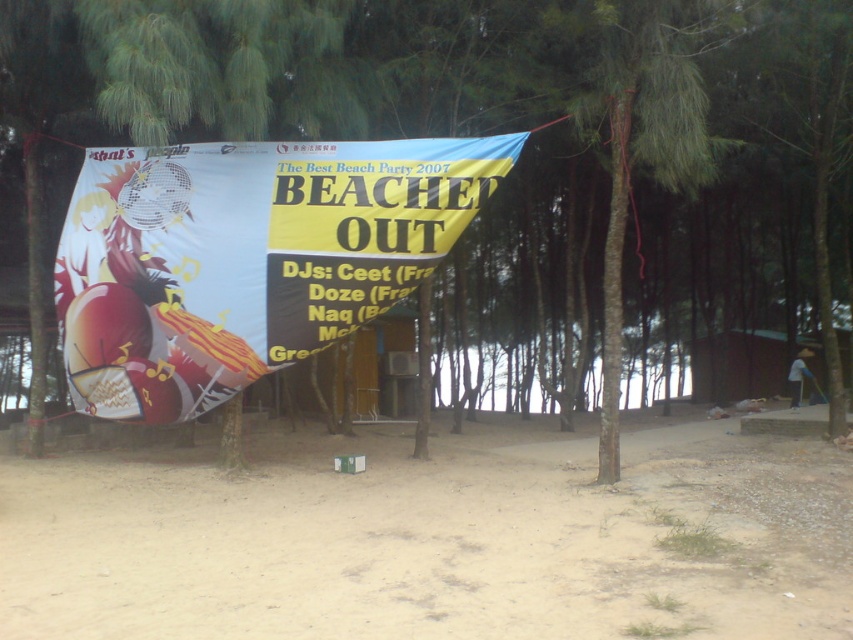
What are the coordinates of the sandy brown dirt at lower center in the image?

The coordinates of the sandy brown dirt at lower center are at point (436, 541).

You are standing at the beach party scene. You see the sandy brown dirt at lower center and the white glossy banner at center. Which object is closer to the ground?

The sandy brown dirt at lower center is closer to the ground since it has a lesser height compared to the white glossy banner at center.